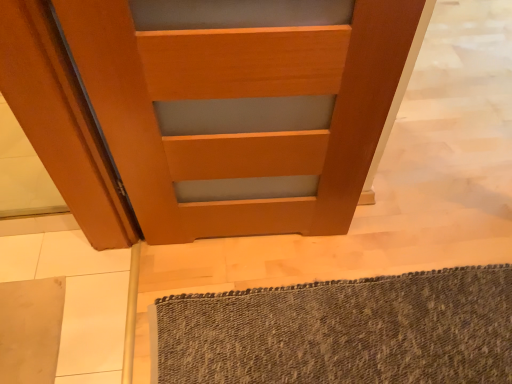
At what (x,y) coordinates should I click in order to perform the action: click on vacant space underneath wooden door at center (from a real-world perspective). Please return your answer as a coordinate pair (x, y). Looking at the image, I should click on (242, 240).